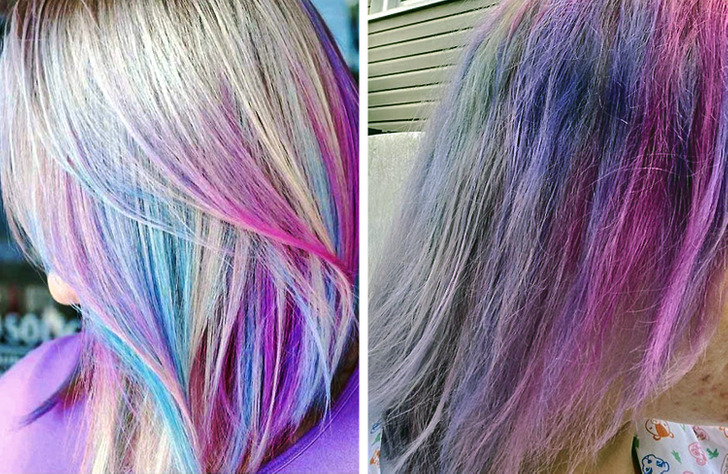
Locate an element on the screen. paneling of house is located at coordinates (400, 50).